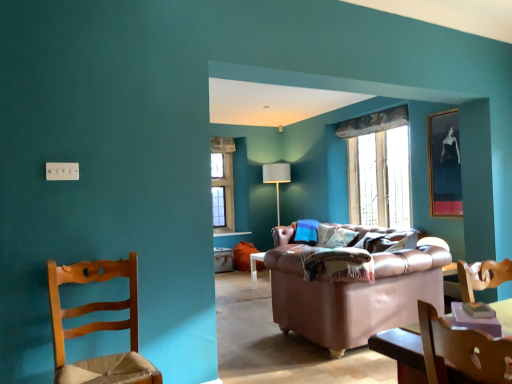
Question: Can you confirm if leather couch at center is bigger than wooden chair at left?

Choices:
 (A) no
 (B) yes

Answer: (B)

Question: Is the depth of leather couch at center greater than that of wooden chair at left?

Choices:
 (A) yes
 (B) no

Answer: (A)

Question: Is leather couch at center at the left side of wooden chair at left?

Choices:
 (A) no
 (B) yes

Answer: (A)

Question: Is leather couch at center wider than wooden chair at left?

Choices:
 (A) no
 (B) yes

Answer: (B)

Question: Considering the relative sizes of leather couch at center and wooden chair at left in the image provided, is leather couch at center shorter than wooden chair at left?

Choices:
 (A) yes
 (B) no

Answer: (B)

Question: Is leather couch at center wider or thinner than wooden chair at left?

Choices:
 (A) thin
 (B) wide

Answer: (B)

Question: From the image's perspective, is leather couch at center above or below wooden chair at left?

Choices:
 (A) below
 (B) above

Answer: (A)

Question: Would you say leather couch at center is inside or outside wooden chair at left?

Choices:
 (A) outside
 (B) inside

Answer: (A)

Question: Visually, is leather couch at center positioned to the left or to the right of wooden chair at left?

Choices:
 (A) right
 (B) left

Answer: (A)

Question: From a real-world perspective, is white plastic electric outlet at upper left above or below clear glass window at center?

Choices:
 (A) below
 (B) above

Answer: (A)

Question: Is white plastic electric outlet at upper left inside or outside of clear glass window at center?

Choices:
 (A) outside
 (B) inside

Answer: (A)

Question: Does point (72, 168) appear closer or farther from the camera than point (366, 190)?

Choices:
 (A) farther
 (B) closer

Answer: (B)

Question: Looking at their shapes, would you say white plastic electric outlet at upper left is wider or thinner than clear glass window at center?

Choices:
 (A) thin
 (B) wide

Answer: (A)

Question: Considering the positions of wooden chair at left and matte black picture frame at upper right in the image, is wooden chair at left taller or shorter than matte black picture frame at upper right?

Choices:
 (A) tall
 (B) short

Answer: (B)

Question: Is wooden chair at left in front of or behind matte black picture frame at upper right in the image?

Choices:
 (A) front
 (B) behind

Answer: (A)